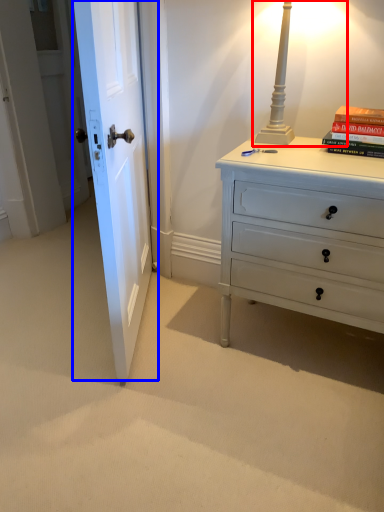
Question: Which of the following is the farthest to the observer, table lamp (highlighted by a red box) or door (highlighted by a blue box)?

Choices:
 (A) table lamp
 (B) door

Answer: (A)